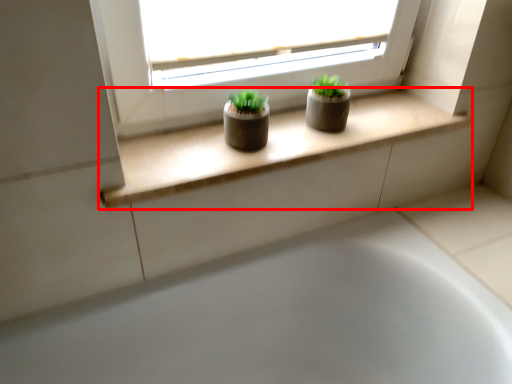
Question: From the image, what is the correct spatial relationship of window sill (annotated by the red box) in relation to bathtub?

Choices:
 (A) right
 (B) left

Answer: (A)